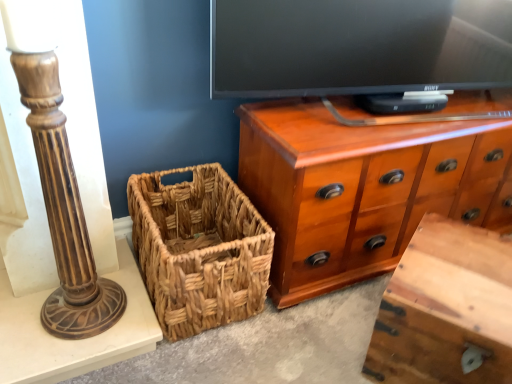
I want to click on blank space above wooden vanity at lower right (from a real-world perspective), so click(462, 259).